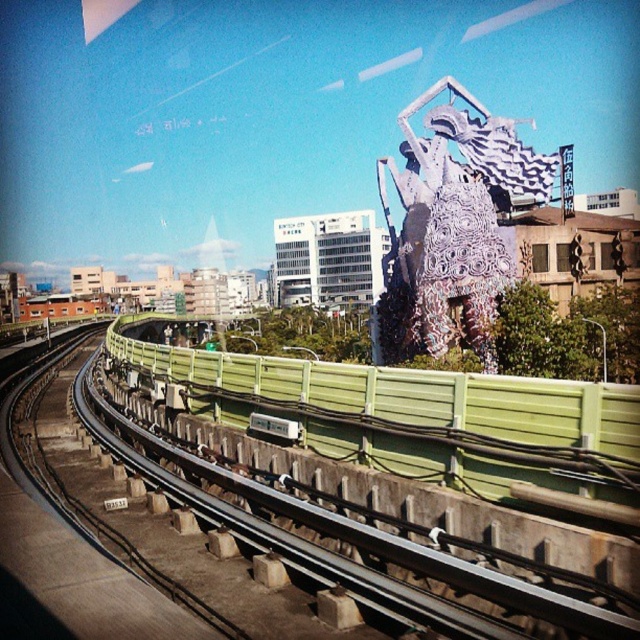
You are a photographer trying to capture both the green concrete rail at center and the white metallic sculpture at upper right in a single frame. Given their heights, which object will appear smaller in the photo?

The green concrete rail at center will appear smaller in the photo because it has a lesser height compared to the white metallic sculpture at upper right.

You are a photographer trying to capture both the green concrete rail at center and the white metallic sculpture at upper right in a single frame. Considering their sizes, which object should you focus on first to ensure both are clearly visible in your photo?

The green concrete rail at center is larger than the white metallic sculpture at upper right, so focusing on the green concrete rail at center first will help ensure both objects are clearly visible in the photo.

You are a photographer trying to capture the urban scene from the train window. You notice two points of interest marked as point 1 at coordinates (218, 476) and point 2 at coordinates (420, 333). Which point do you think will appear larger in your photo?

Point 1 at coordinates (218, 476) is closer to the camera than point 2 at coordinates (420, 333), so it will appear larger in the photo.